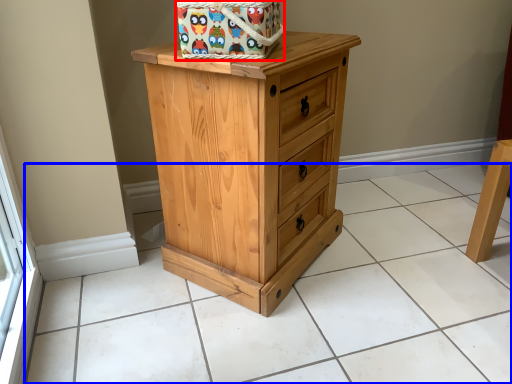
Question: Which point is closer to the camera, gift basket (highlighted by a red box) or tile (highlighted by a blue box)?

Choices:
 (A) gift basket
 (B) tile

Answer: (B)